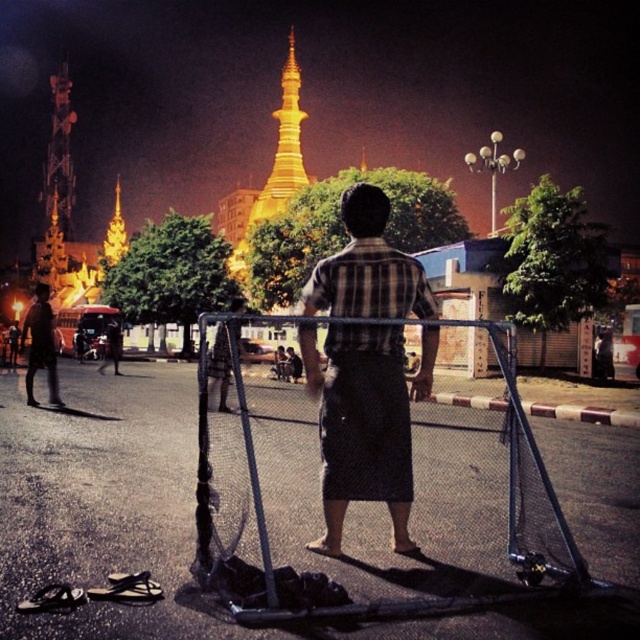
You are standing in the public square and want to walk towards the golden pagoda in the background. Which object, the metallic wire fence at center or the dark gray pants at lower left, would you encounter first?

The metallic wire fence at center is closer to the viewer than the dark gray pants at lower left, so you would encounter the metallic wire fence at center first.

You are a photographer trying to capture the golden pagoda in the background while also including the man in the plaid fabric shirt at center and the metallic wire fence at center in your shot. Based on their positions, which object is closer to the camera?

The plaid fabric shirt at center is closer to the camera because the metallic wire fence at center is positioned on its right side, indicating it is further away.

You are a photographer trying to capture a wide shot of the golden pagoda in the background. You notice the metallic wire fence at center and the dark gray pants at lower left are in your frame. Which object will you need to adjust your camera angle to avoid since it is wider?

The metallic wire fence at center is wider than the dark gray pants at lower left, so you should adjust your camera angle to avoid the metallic wire fence at center.